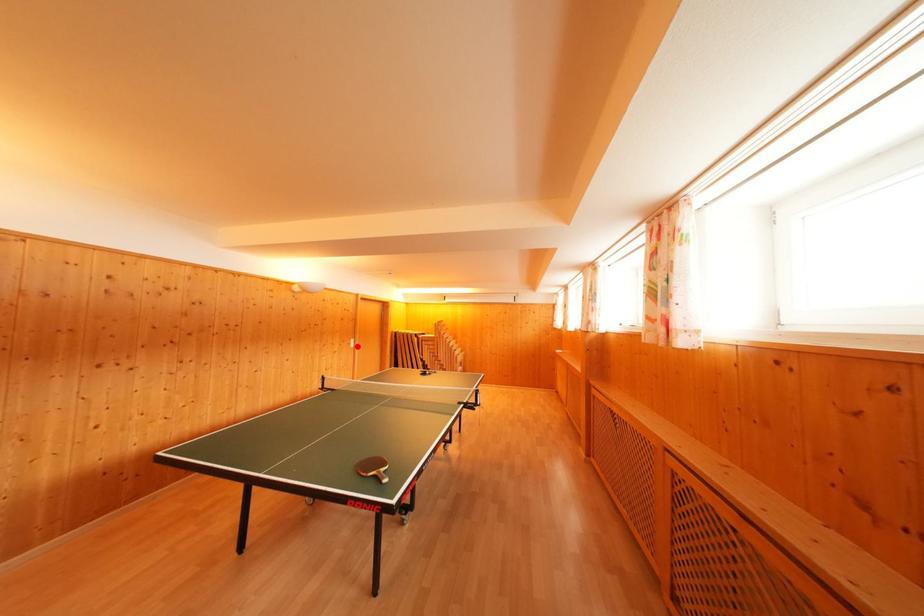
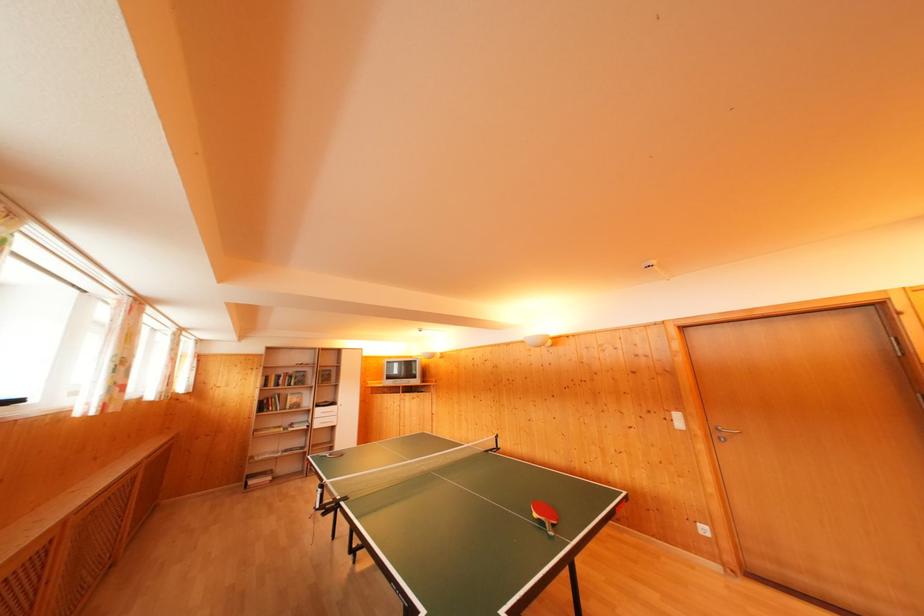
Locate, in the second image, the point that corresponds to the highlighted location in the first image.

(682, 421)